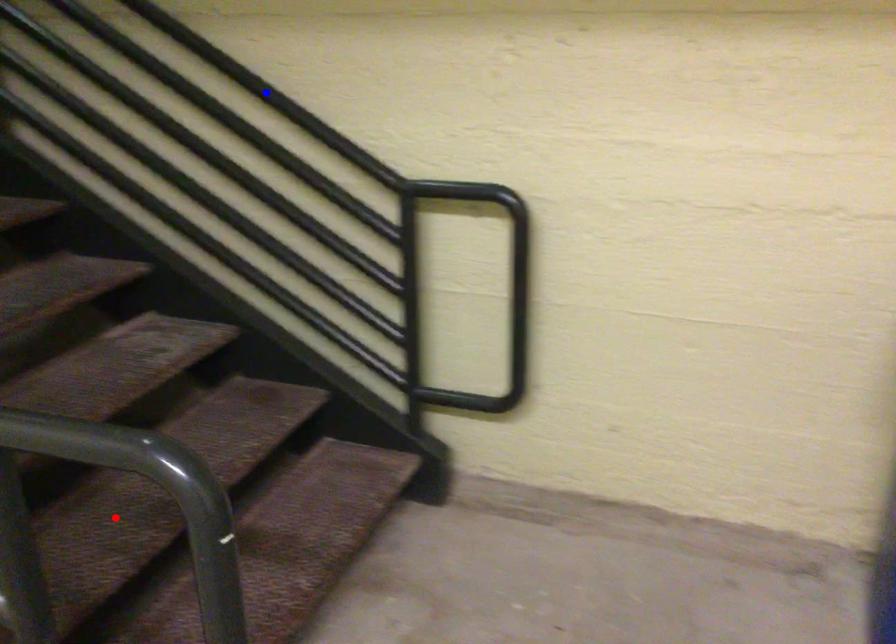
Question: Which of the two points in the image is closer to the camera?

Choices:
 (A) Blue point is closer.
 (B) Red point is closer.

Answer: (A)